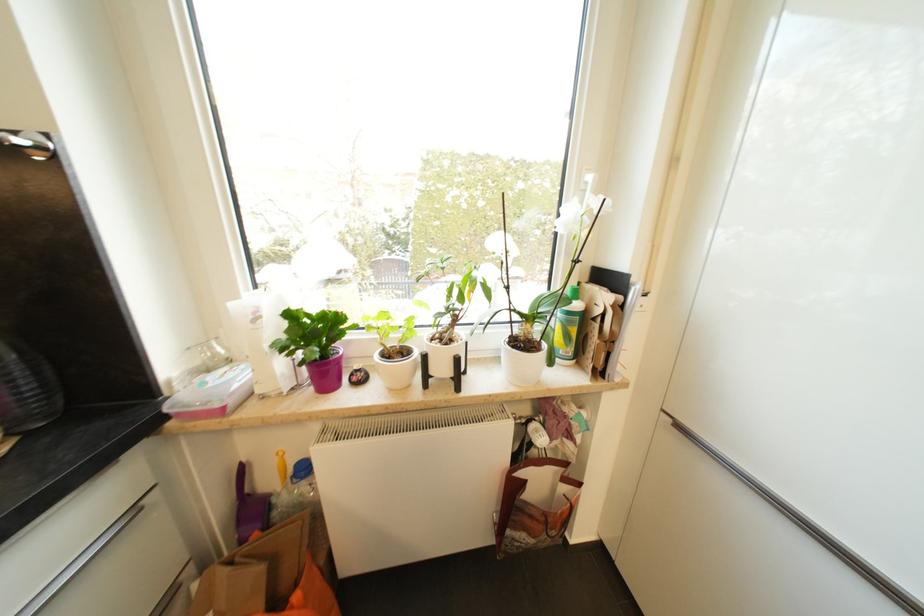
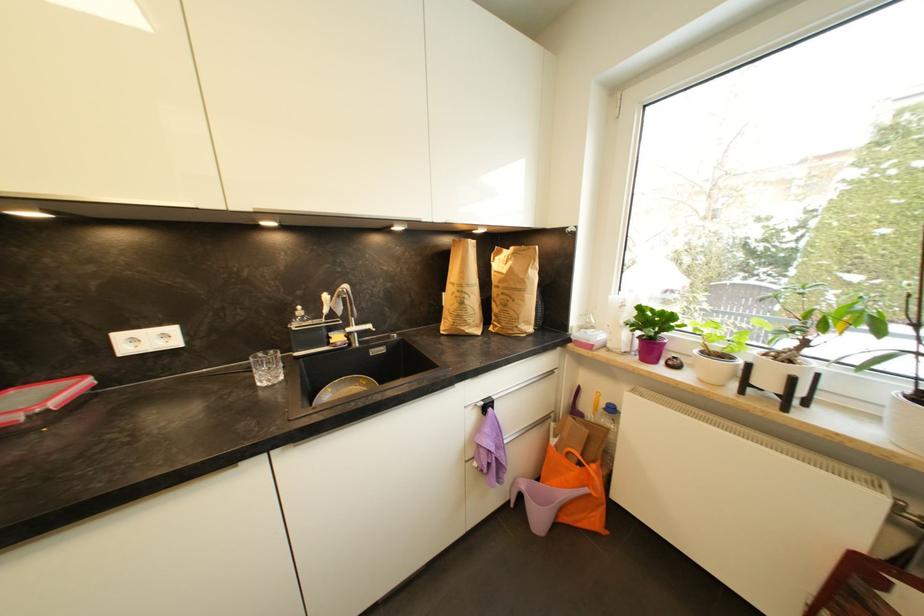
Question: Based on the continuous images, in which direction is the camera rotating? Reply with the corresponding letter.

Choices:
 (A) Left
 (B) Right
 (C) Up
 (D) Down

Answer: (A)